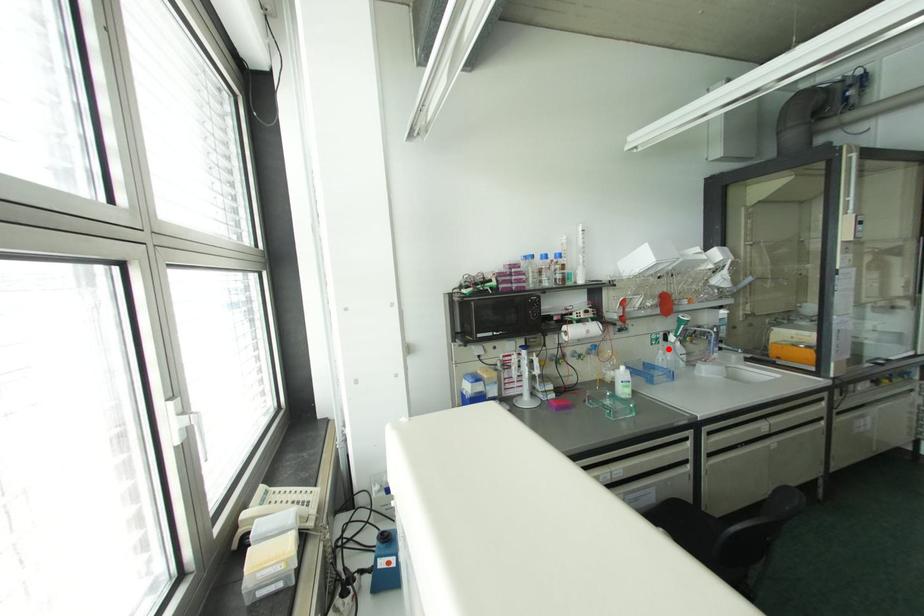
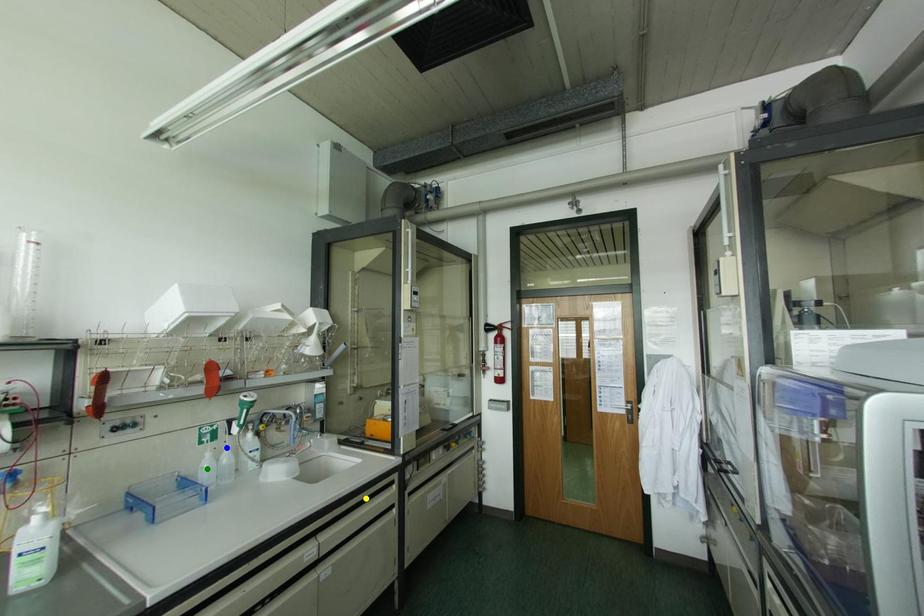
Question: I am providing you with two images of the same scene from different viewpoints. A red point is marked on the first image. You are given multiple points on the second image. Which spot in image 2 lines up with the point in image 1?

Choices:
 (A) yellow point
 (B) blue point
 (C) green point

Answer: (B)